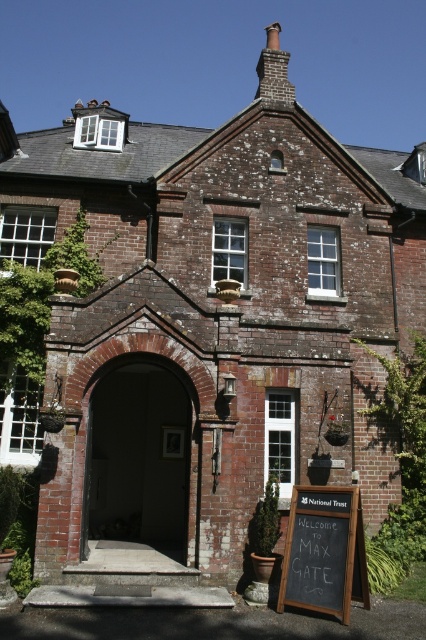
Question: Does brick archway at center have a greater width compared to black chalkboard at lower right?

Choices:
 (A) yes
 (B) no

Answer: (A)

Question: Is brick archway at center positioned behind black chalkboard at lower right?

Choices:
 (A) yes
 (B) no

Answer: (A)

Question: Which point is farther to the camera?

Choices:
 (A) (97, 467)
 (B) (340, 493)

Answer: (A)

Question: Does brick archway at center have a smaller size compared to black chalkboard at lower right?

Choices:
 (A) yes
 (B) no

Answer: (B)